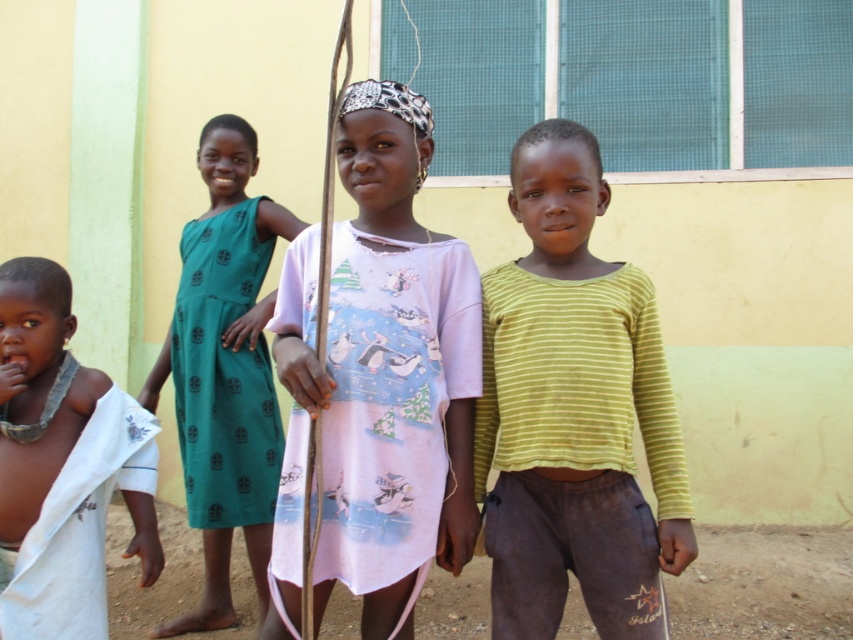
Question: Which of the following is the closest to the observer?

Choices:
 (A) (227, 202)
 (B) (395, 538)

Answer: (B)

Question: Is pink cotton dress at center further to camera compared to yellow-green striped shirt at center?

Choices:
 (A) yes
 (B) no

Answer: (B)

Question: Among these objects, which one is nearest to the camera?

Choices:
 (A) yellow-green striped shirt at center
 (B) green printed dress at left
 (C) white cloth at left

Answer: (A)

Question: Does pink cotton dress at center lie behind white cloth at left?

Choices:
 (A) no
 (B) yes

Answer: (A)

Question: Can you confirm if green printed dress at left is positioned below white cloth at left?

Choices:
 (A) no
 (B) yes

Answer: (A)

Question: Which object is farther from the camera taking this photo?

Choices:
 (A) pink cotton dress at center
 (B) white cloth at left

Answer: (B)